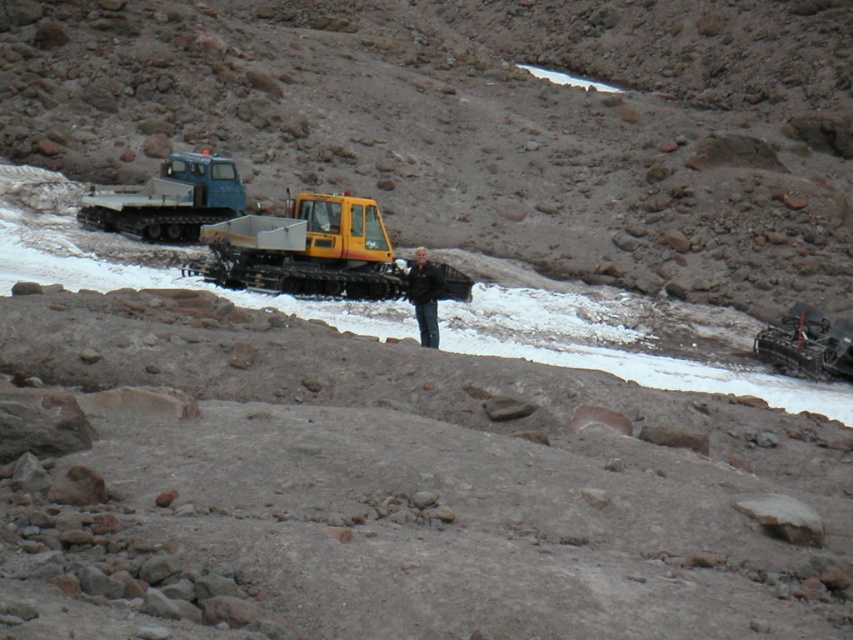
Based on the photo, who is taller, yellow rubber tracked vehicle at center or blue rubber tracked vehicle at left?

yellow rubber tracked vehicle at center

Is yellow rubber tracked vehicle at center positioned before blue rubber tracked vehicle at left?

Yes, it is.

Is point (253, 250) positioned after point (155, 184)?

No.

Find the location of `yellow rubber tracked vehicle at center`. yellow rubber tracked vehicle at center is located at coordinates (305, 250).

Who is shorter, yellow rubber tracked vehicle at center or black matte jacket at center?

With less height is black matte jacket at center.

This screenshot has width=853, height=640. What are the coordinates of `yellow rubber tracked vehicle at center` in the screenshot? It's located at click(x=305, y=250).

At what (x,y) coordinates should I click in order to perform the action: click on yellow rubber tracked vehicle at center. Please return your answer as a coordinate pair (x, y). This screenshot has height=640, width=853. Looking at the image, I should click on (305, 250).

Is rocky dirt at center taller than black matte jacket at center?

Correct, rocky dirt at center is much taller as black matte jacket at center.

In the scene shown: Can you confirm if rocky dirt at center is positioned above black matte jacket at center?

Correct, rocky dirt at center is located above black matte jacket at center.

Find the location of `rocky dirt at center`. rocky dirt at center is located at coordinates (482, 122).